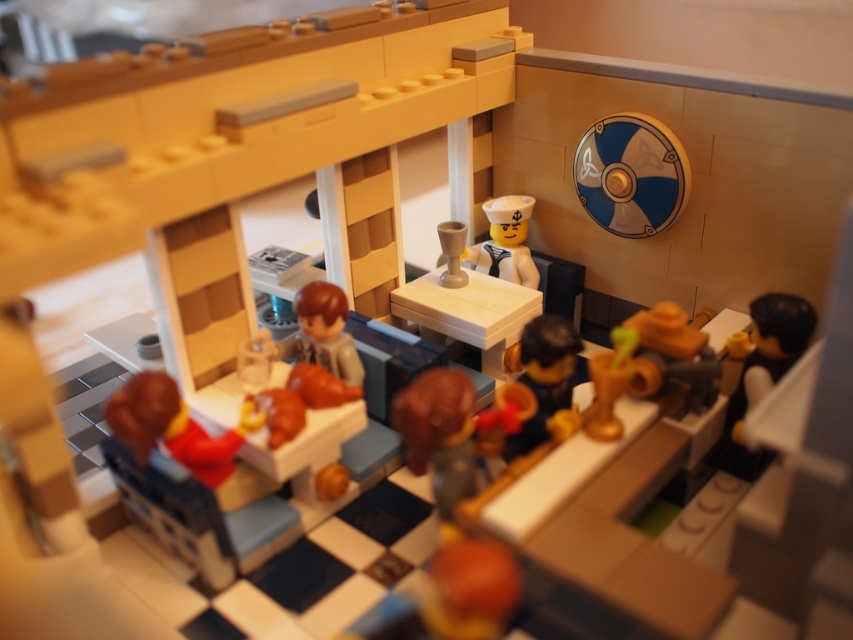
Is point (570, 369) in front of point (508, 237)?

That is True.

Is point (538, 442) positioned in front of point (503, 241)?

That is True.

Find the location of a particular element. The width and height of the screenshot is (853, 640). shiny brown bowl at center is located at coordinates (544, 376).

Does smooth brown minifigure at center appear over satin white sailor hat at upper center?

Actually, smooth brown minifigure at center is below satin white sailor hat at upper center.

This screenshot has width=853, height=640. What do you see at coordinates (323, 332) in the screenshot?
I see `smooth brown minifigure at center` at bounding box center [323, 332].

Who is more distant from viewer, (320, 356) or (517, 244)?

Point (517, 244)

Find the location of `smooth brown minifigure at center`. smooth brown minifigure at center is located at coordinates (323, 332).

Is shiny brown bowl at center bigger than smooth brown minifigure at center?

Yes, shiny brown bowl at center is bigger than smooth brown minifigure at center.

You are a GUI agent. You are given a task and a screenshot of the screen. Output one action in this format:
    pyautogui.click(x=<x>, y=<y>)
    Task: Click on the shiny brown bowl at center
    Image resolution: width=853 pixels, height=640 pixels.
    Given the screenshot: What is the action you would take?
    pyautogui.click(x=544, y=376)

Locate an element on the screen. shiny brown bowl at center is located at coordinates (544, 376).

Identify the location of shiny brown bowl at center. (544, 376).